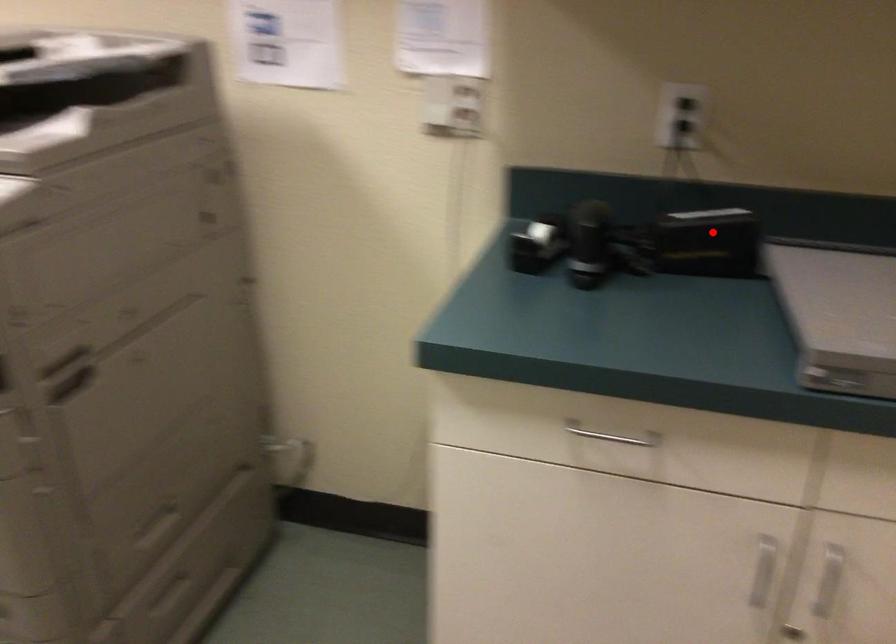
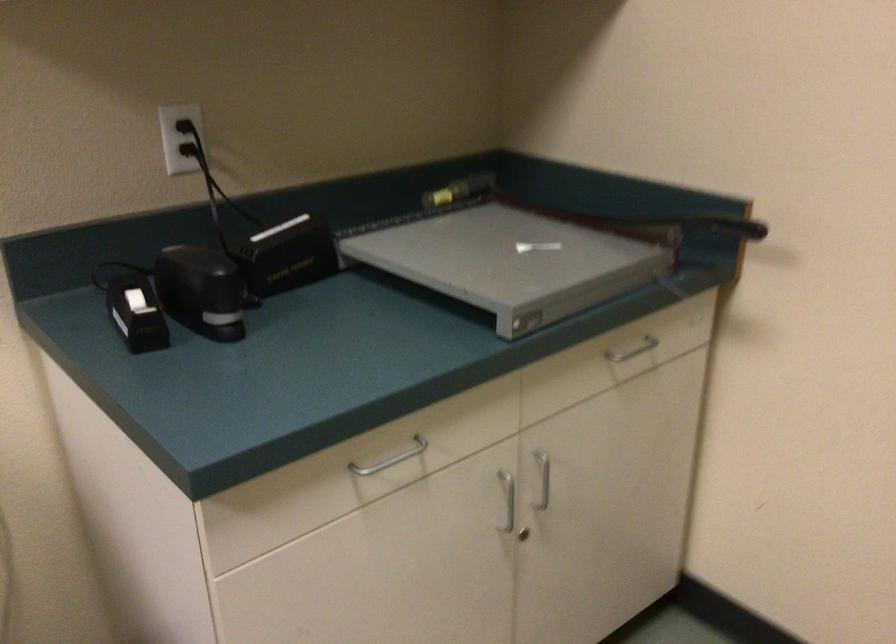
Where in the second image is the point corresponding to the highlighted location from the first image?

(293, 247)